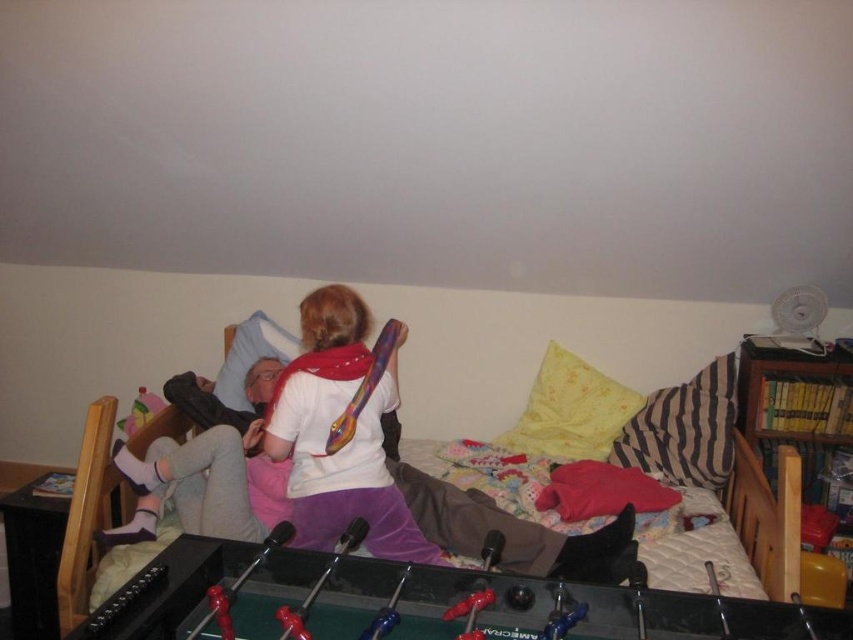
You are organizing a game night and need to place a new toy on the table. The black glossy foosball table at lower center and the matte plastic toy at upper left are in the room. Which object is closer to the right side of the room?

The black glossy foosball table at lower center is to the right of the matte plastic toy at upper left, so it is closer to the right side of the room.